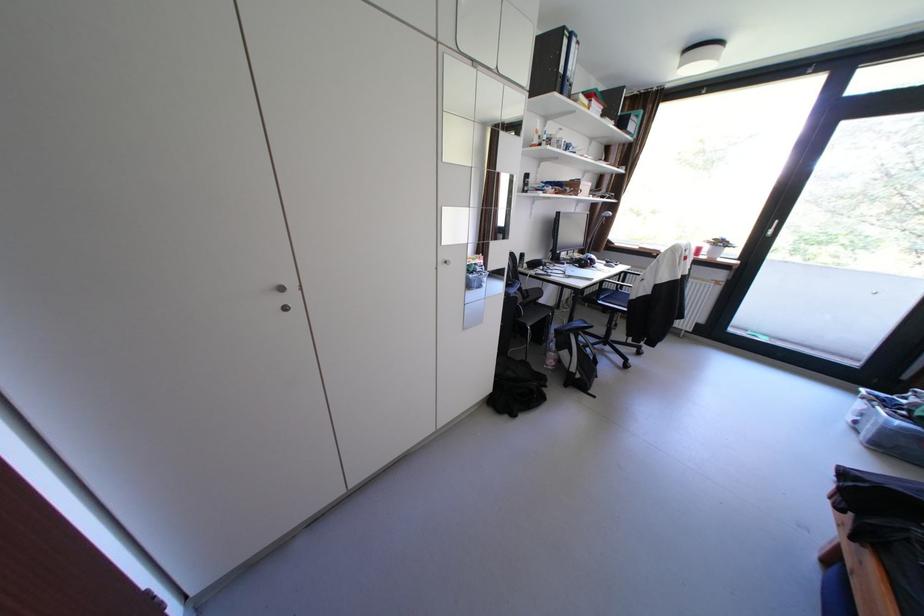
What do you see at coordinates (614, 301) in the screenshot? The width and height of the screenshot is (924, 616). I see `a chair sitting surface` at bounding box center [614, 301].